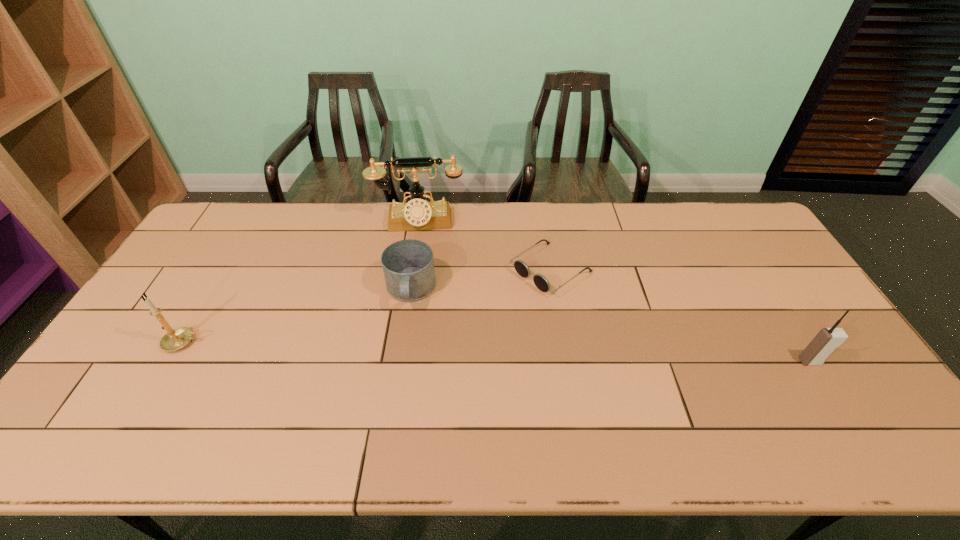
Where is `vacant point located on the front-facing side of the fourth object from left to right`? The width and height of the screenshot is (960, 540). vacant point located on the front-facing side of the fourth object from left to right is located at coordinates (489, 313).

What are the coordinates of `blank area located on the front-facing side of the fourth object from left to right` in the screenshot? It's located at (492, 312).

Locate an element on the screen. The height and width of the screenshot is (540, 960). vacant space located on the front-facing side of the fourth object from left to right is located at coordinates (492, 312).

This screenshot has width=960, height=540. Identify the location of vacant space situated 0.300m on the dial of the farthest object. (419, 299).

At what (x,y) coordinates should I click in order to perform the action: click on vacant region located 0.210m on the dial of the farthest object. Please return your answer as a coordinate pair (x, y). This screenshot has width=960, height=540. Looking at the image, I should click on [419, 278].

Identify the location of vacant area located on the dial of the farthest object. Image resolution: width=960 pixels, height=540 pixels. (419, 280).

At what (x,y) coordinates should I click in order to perform the action: click on free space located on the side of the mug with the handle. Please return your answer as a coordinate pair (x, y). This screenshot has height=540, width=960. Looking at the image, I should click on (401, 380).

This screenshot has width=960, height=540. Find the location of `free region located 0.160m on the side of the mug with the handle`. free region located 0.160m on the side of the mug with the handle is located at coordinates (403, 363).

The image size is (960, 540). Find the location of `vacant space located 0.230m on the side of the mug with the handle`. vacant space located 0.230m on the side of the mug with the handle is located at coordinates pyautogui.click(x=400, y=387).

You are a GUI agent. You are given a task and a screenshot of the screen. Output one action in this format:
    pyautogui.click(x=<x>, y=<y>)
    Task: Click on the sunglasses located at the far edge
    Image resolution: width=960 pixels, height=540 pixels.
    Given the screenshot: What is the action you would take?
    pyautogui.click(x=540, y=281)